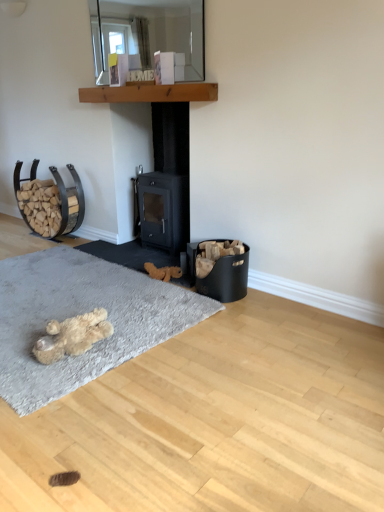
The image size is (384, 512). Describe the element at coordinates (167, 181) in the screenshot. I see `black matte fireplace at center` at that location.

Identify the location of clear glass mirror at upper center. This screenshot has height=512, width=384. (148, 32).

At what (x,y) coordinates should I click in order to perform the action: click on wooden at upper center. Please return your answer as a coordinate pair (x, y). The height and width of the screenshot is (512, 384). Looking at the image, I should click on (150, 93).

Describe the element at coordinates (72, 336) in the screenshot. I see `fuzzy beige teddy bear at lower left, the 2th animal when ordered from right to left` at that location.

You are a GUI agent. You are given a task and a screenshot of the screen. Output one action in this format:
    pyautogui.click(x=<x>, y=<y>)
    Task: Click on the soft gray carpet at lower left
    This screenshot has width=384, height=512.
    Given the screenshot: What is the action you would take?
    pyautogui.click(x=81, y=313)

Between black matte fireplace at center and clear glass mirror at upper center, which one appears on the left side from the viewer's perspective?

clear glass mirror at upper center.

From the picture: From the image's perspective, between black matte fireplace at center and clear glass mirror at upper center, which one is located above?

From the image's view, clear glass mirror at upper center is above.

Are black matte fireplace at center and clear glass mirror at upper center located far from each other?

No, black matte fireplace at center is not far away from clear glass mirror at upper center.

The width and height of the screenshot is (384, 512). Find the location of `fireplace that appears on the right of clear glass mirror at upper center`. fireplace that appears on the right of clear glass mirror at upper center is located at coordinates (167, 181).

From a real-world perspective, which object rests below the other?

fuzzy beige teddy bear at lower left, the 2th animal when ordered from right to left.

Who is taller, fuzzy beige teddy bear at lower left, which is the first animal from front to back, or black matte fireplace at center?

Standing taller between the two is black matte fireplace at center.

Considering the positions of objects fuzzy beige teddy bear at lower left, which appears as the second animal when viewed from the back, and black matte fireplace at center in the image provided, who is more to the right, fuzzy beige teddy bear at lower left, which appears as the second animal when viewed from the back, or black matte fireplace at center?

black matte fireplace at center.

What's the angular difference between fuzzy beige teddy bear at lower left, the 1th animal positioned from the left, and black matte fireplace at center's facing directions?

The facing directions of fuzzy beige teddy bear at lower left, the 1th animal positioned from the left, and black matte fireplace at center are 179 degrees apart.

Which object is closer to the camera taking this photo, black matte fireplace at center or soft gray carpet at lower left?

Positioned in front is soft gray carpet at lower left.

From a real-world perspective, does black matte fireplace at center sit lower than soft gray carpet at lower left?

No, from a real-world perspective, black matte fireplace at center is not under soft gray carpet at lower left.

Between black matte fireplace at center and soft gray carpet at lower left, which one has less height?

With less height is soft gray carpet at lower left.

Locate an element on the screen. This screenshot has width=384, height=512. mat located in front of the black matte fireplace at center is located at coordinates (81, 313).

Is clear glass mirror at upper center taller than black matte fireplace at center?

No, clear glass mirror at upper center is not taller than black matte fireplace at center.

Which object is positioned more to the left, clear glass mirror at upper center or black matte fireplace at center?

From the viewer's perspective, clear glass mirror at upper center appears more on the left side.

Which object is closer to the camera taking this photo, clear glass mirror at upper center or black matte fireplace at center?

clear glass mirror at upper center is closer to the camera.

Is clear glass mirror at upper center turned away from black matte fireplace at center?

A: No.

The image size is (384, 512). Find the location of `animal on the left side of brown plush toy at center, the second animal from the bottom`. animal on the left side of brown plush toy at center, the second animal from the bottom is located at coordinates (72, 336).

Considering the positions of objects fuzzy beige teddy bear at lower left, the 2th animal when ordered from right to left, and brown plush toy at center, placed as the 1th animal when sorted from right to left, in the image provided, who is more to the right, fuzzy beige teddy bear at lower left, the 2th animal when ordered from right to left, or brown plush toy at center, placed as the 1th animal when sorted from right to left,?

brown plush toy at center, placed as the 1th animal when sorted from right to left, is more to the right.

Does point (44, 337) lie behind point (147, 270)?

No, (44, 337) is in front of (147, 270).

Does fuzzy beige teddy bear at lower left, the 2th animal when ordered from right to left, turn towards brown plush toy at center, the second animal from the bottom?

Yes, fuzzy beige teddy bear at lower left, the 2th animal when ordered from right to left, is oriented towards brown plush toy at center, the second animal from the bottom.

From the image's perspective, is soft gray carpet at lower left positioned above or below black matte fireplace at center?

Clearly, from the image's perspective, soft gray carpet at lower left is below black matte fireplace at center.

From a real-world perspective, which is physically above, soft gray carpet at lower left or black matte fireplace at center?

black matte fireplace at center, from a real-world perspective.

At what (x,y) coordinates should I click in order to perform the action: click on fireplace behind the soft gray carpet at lower left. Please return your answer as a coordinate pair (x, y). Image resolution: width=384 pixels, height=512 pixels. Looking at the image, I should click on (167, 181).

Is point (38, 280) positioned in front of point (139, 187)?

Yes.

Does point (182, 101) lie behind point (171, 267)?

No, (182, 101) is closer to viewer.

Can you tell me how much wooden at upper center and brown plush toy at center, which is the 1th animal in back-to-front order, differ in facing direction?

They differ by 0.997 degrees in their facing directions.

Would you say wooden at upper center is outside brown plush toy at center, the second animal from the bottom?

That's correct, wooden at upper center is outside of brown plush toy at center, the second animal from the bottom.

In order to click on animal behind the wooden at upper center in this screenshot , I will do `click(162, 272)`.

Identify the location of mirror above the black matte fireplace at center (from a real-world perspective). (148, 32).

Where is `the 2nd animal in front when counting from the black matte fireplace at center`? The height and width of the screenshot is (512, 384). the 2nd animal in front when counting from the black matte fireplace at center is located at coordinates (72, 336).

Considering their positions, is brown plush toy at center, the second animal from the bottom, positioned closer to clear glass mirror at upper center than fuzzy beige teddy bear at lower left, which is the first animal from front to back?

brown plush toy at center, the second animal from the bottom, is closer to clear glass mirror at upper center.

When comparing their distances from wooden at upper center, does clear glass mirror at upper center or fuzzy beige teddy bear at lower left, the 2th animal when ordered from right to left, seem further?

The object further to wooden at upper center is fuzzy beige teddy bear at lower left, the 2th animal when ordered from right to left.

Estimate the real-world distances between objects in this image. Which object is closer to clear glass mirror at upper center, soft gray carpet at lower left or wooden at upper center?

wooden at upper center is positioned closer to the anchor clear glass mirror at upper center.

Looking at the image, which one is located closer to brown plush toy at center, which appears as the 1th animal when viewed from the top, fuzzy beige teddy bear at lower left, the 1th animal positioned from the left, or soft gray carpet at lower left?

The object closer to brown plush toy at center, which appears as the 1th animal when viewed from the top, is soft gray carpet at lower left.

From the image, which object appears to be farther from brown plush toy at center, placed as the 1th animal when sorted from right to left, black matte fireplace at center or fuzzy beige teddy bear at lower left, which appears as the 2th animal when viewed from the top?

Among the two, fuzzy beige teddy bear at lower left, which appears as the 2th animal when viewed from the top, is located further to brown plush toy at center, placed as the 1th animal when sorted from right to left.

Looking at the image, which one is located further to wooden at upper center, soft gray carpet at lower left or clear glass mirror at upper center?

Among the two, soft gray carpet at lower left is located further to wooden at upper center.

Which object lies nearer to the anchor point soft gray carpet at lower left, black matte fireplace at center or clear glass mirror at upper center?

black matte fireplace at center lies closer to soft gray carpet at lower left than the other object.

Which object lies nearer to the anchor point black matte fireplace at center, wooden at upper center or brown plush toy at center, which is counted as the 2th animal, starting from the left?

wooden at upper center.

Where is `animal between fuzzy beige teddy bear at lower left, which appears as the second animal when viewed from the back, and black matte fireplace at center from front to back`? animal between fuzzy beige teddy bear at lower left, which appears as the second animal when viewed from the back, and black matte fireplace at center from front to back is located at coordinates (162, 272).

Where is `shelf that lies between clear glass mirror at upper center and soft gray carpet at lower left from top to bottom`? The image size is (384, 512). shelf that lies between clear glass mirror at upper center and soft gray carpet at lower left from top to bottom is located at coordinates (150, 93).

At what (x,y) coordinates should I click in order to perform the action: click on fireplace that lies between clear glass mirror at upper center and fuzzy beige teddy bear at lower left, which is counted as the first animal, starting from the bottom, from top to bottom. Please return your answer as a coordinate pair (x, y). This screenshot has width=384, height=512. Looking at the image, I should click on (167, 181).

At what (x,y) coordinates should I click in order to perform the action: click on fireplace between clear glass mirror at upper center and brown plush toy at center, placed as the 1th animal when sorted from right to left, from top to bottom. Please return your answer as a coordinate pair (x, y). Looking at the image, I should click on (167, 181).